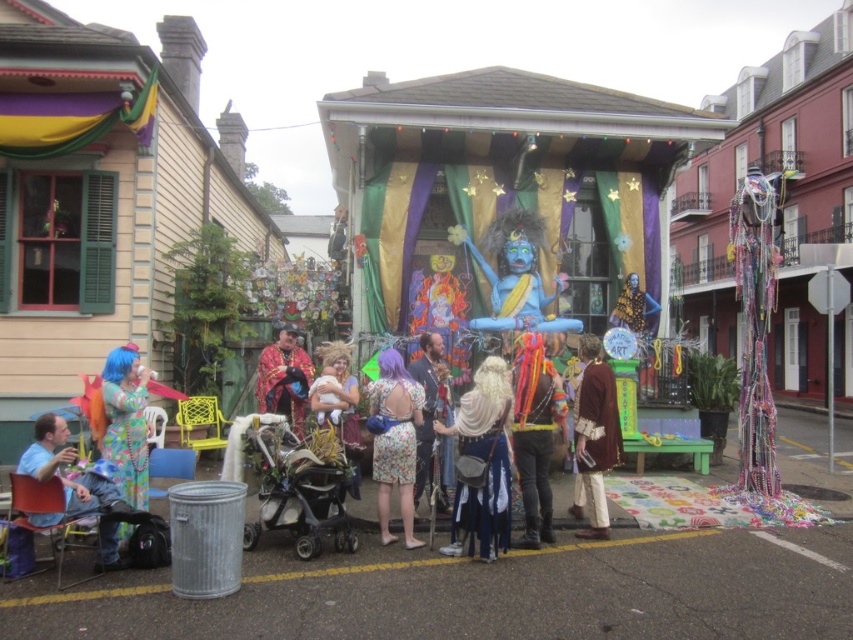
Question: Considering the relative positions of leather boots at center and light blue fabric chair at lower left in the image provided, where is leather boots at center located with respect to light blue fabric chair at lower left?

Choices:
 (A) below
 (B) above

Answer: (B)

Question: Does leather boots at center lie behind velvet red cape at center?

Choices:
 (A) yes
 (B) no

Answer: (B)

Question: Which object is farther from the camera taking this photo?

Choices:
 (A) fluffy yellow costume at center
 (B) silver metallic stroller at center
 (C) floral dress at center
 (D) floral fabric dress at center

Answer: (C)

Question: Considering the relative positions of brown leather jacket at center and light blue fabric chair at lower left in the image provided, where is brown leather jacket at center located with respect to light blue fabric chair at lower left?

Choices:
 (A) left
 (B) right

Answer: (B)

Question: Which point is farther from the camera taking this photo?

Choices:
 (A) (381, 412)
 (B) (595, 536)

Answer: (B)

Question: Which is nearer to the light blue fabric chair at lower left?

Choices:
 (A) brown leather jacket at center
 (B) leather boots at center
 (C) fluorescent blue wig at lower left
 (D) silver metallic stroller at center

Answer: (C)